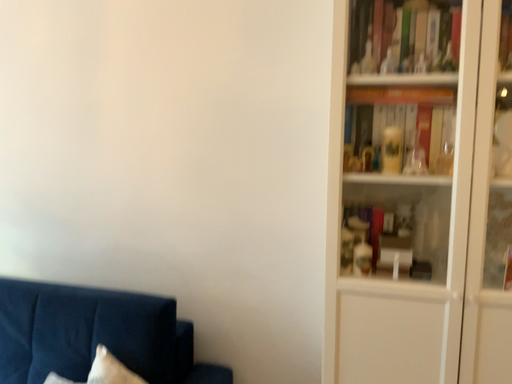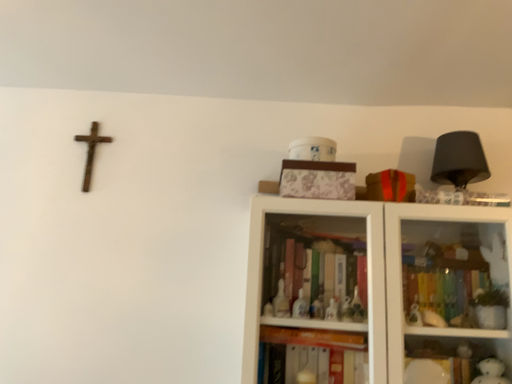
Question: Which way did the camera rotate in the video?

Choices:
 (A) rotated right
 (B) rotated left

Answer: (A)